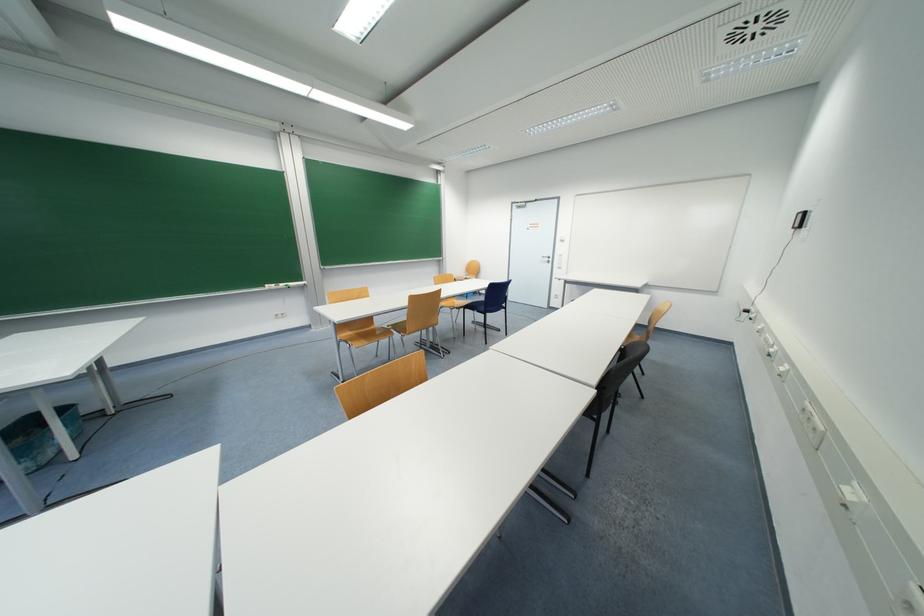
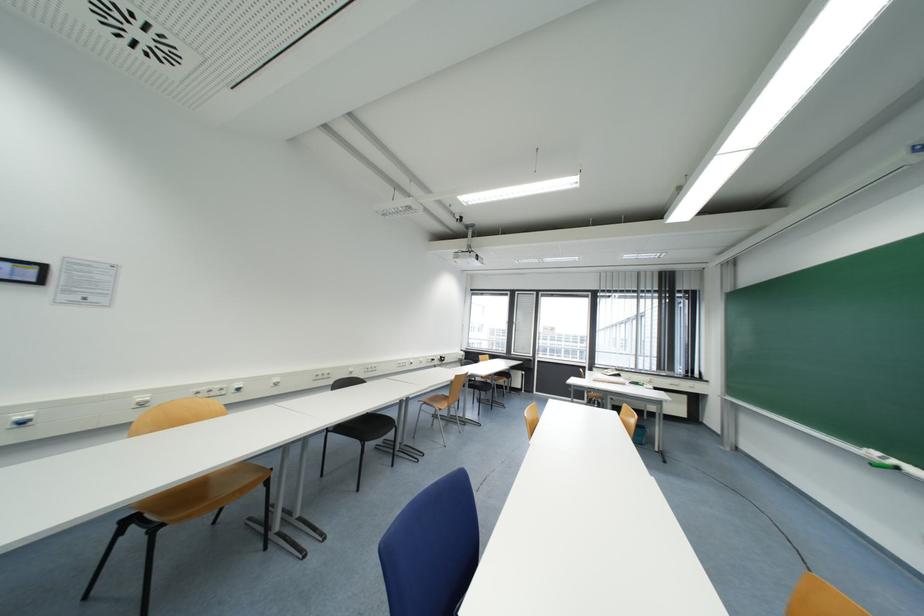
Find the pixel in the second image that matches [286,286] in the first image.

(898, 464)